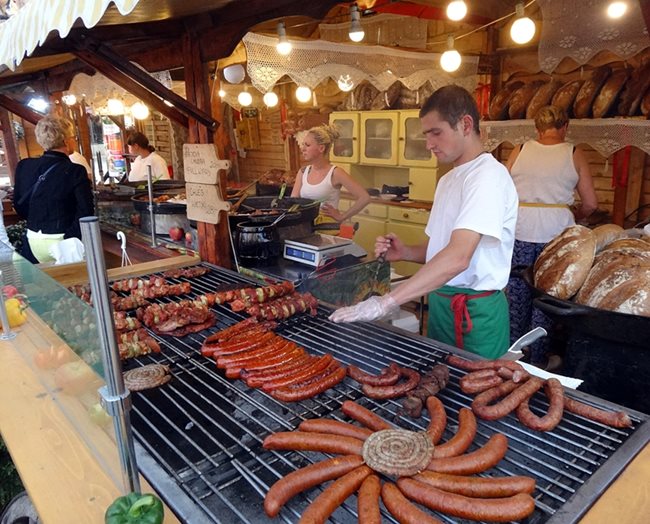
At what (x,y) coordinates should I click in order to perform the action: click on cutting boards. Please return your answer as a coordinate pair (x, y). This screenshot has height=524, width=650. Looking at the image, I should click on (211, 174), (209, 193).